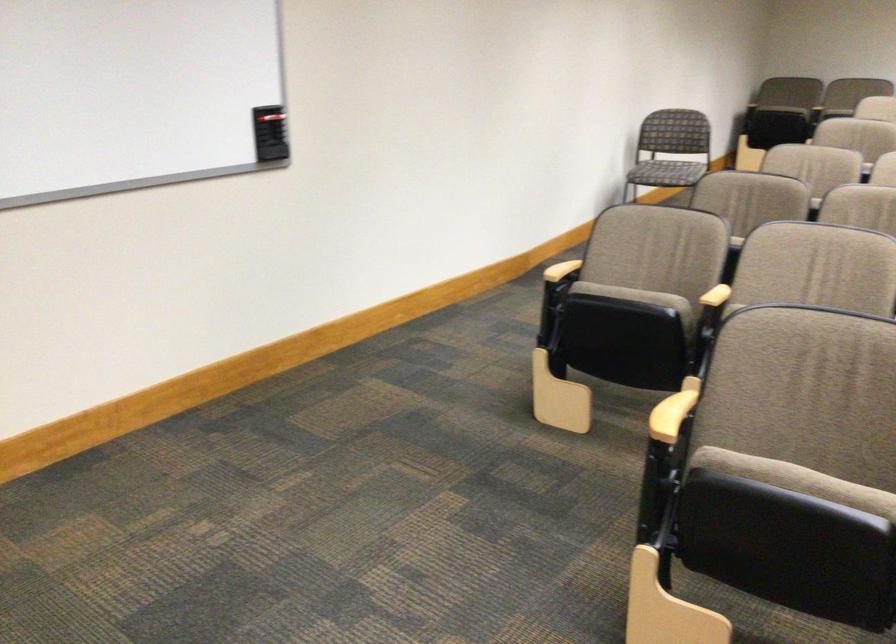
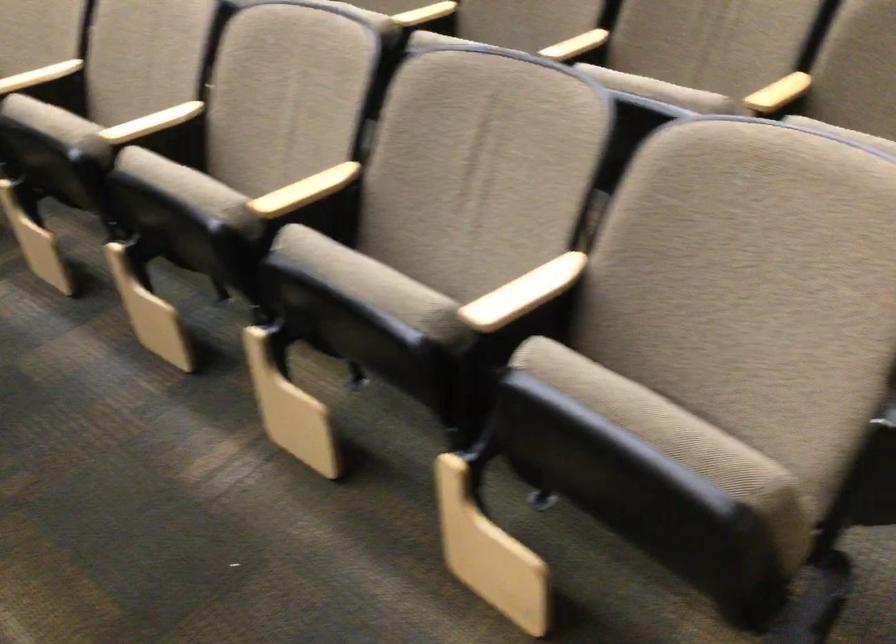
In a continuous first-person perspective shot, in which direction is the camera moving?

The cameraman walked toward right, backward.